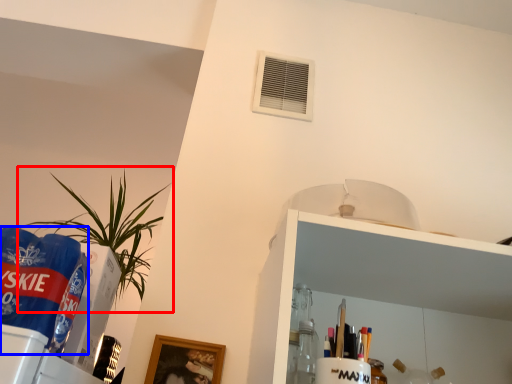
Question: Which point is further to the camera, houseplant (highlighted by a red box) or beverage (highlighted by a blue box)?

Choices:
 (A) houseplant
 (B) beverage

Answer: (A)